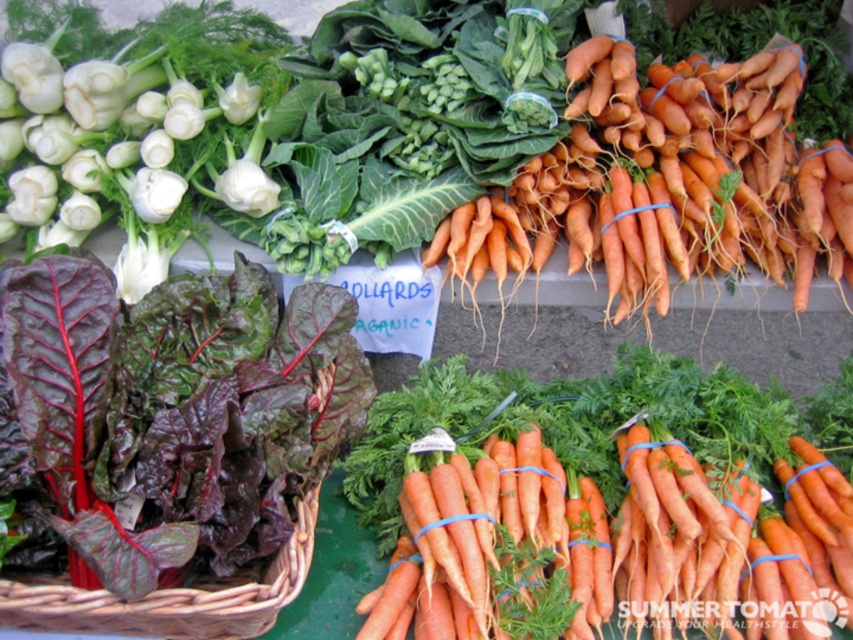
You are standing at the point marked by the coordinates point (x=170, y=413). Looking around the farmer market scene, which object is directly to your left?

The dark red leafy greens at left is represented by point (x=170, y=413), so the object directly to your left would be the carrots with green tops in the foreground.

You are a customer at the farmer market and want to know if the dark red leafy greens at left will fit into the brown woven basket at lower left. Can you determine this based on their sizes?

The dark red leafy greens at left is taller than the brown woven basket at lower left, so it may not fit inside the basket unless the greens are trimmed or the basket is larger.